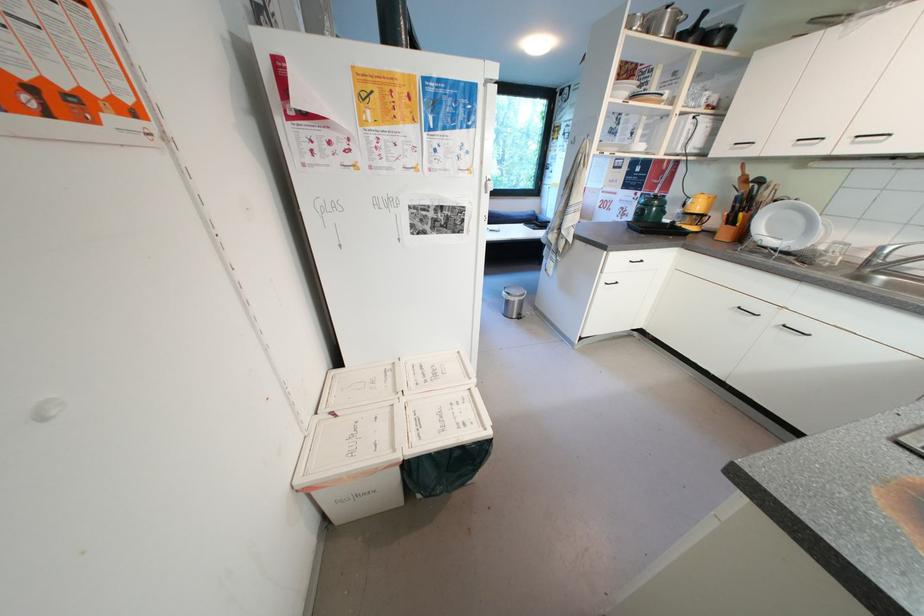
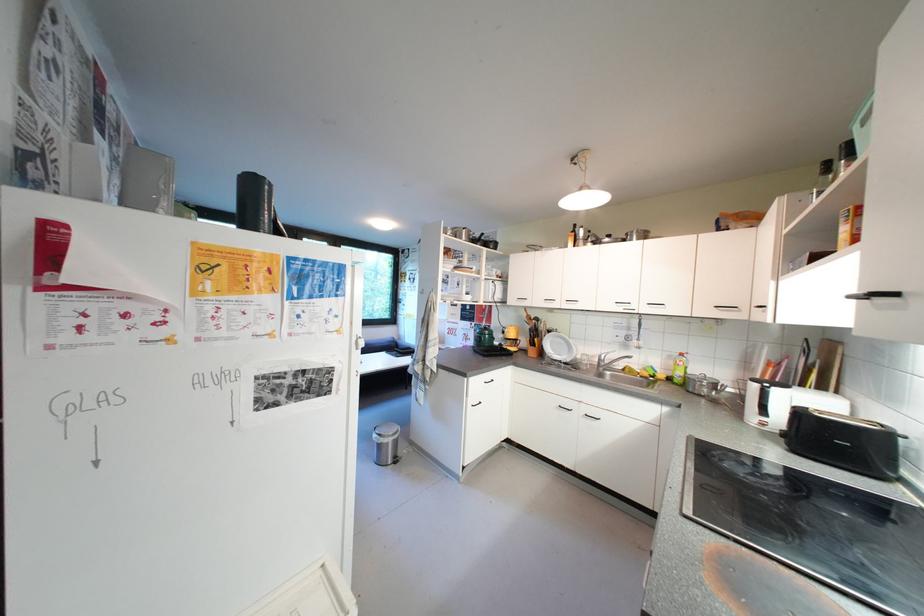
Where in the second image is the point corresponding to pixel 711 156 from the first image?

(512, 304)